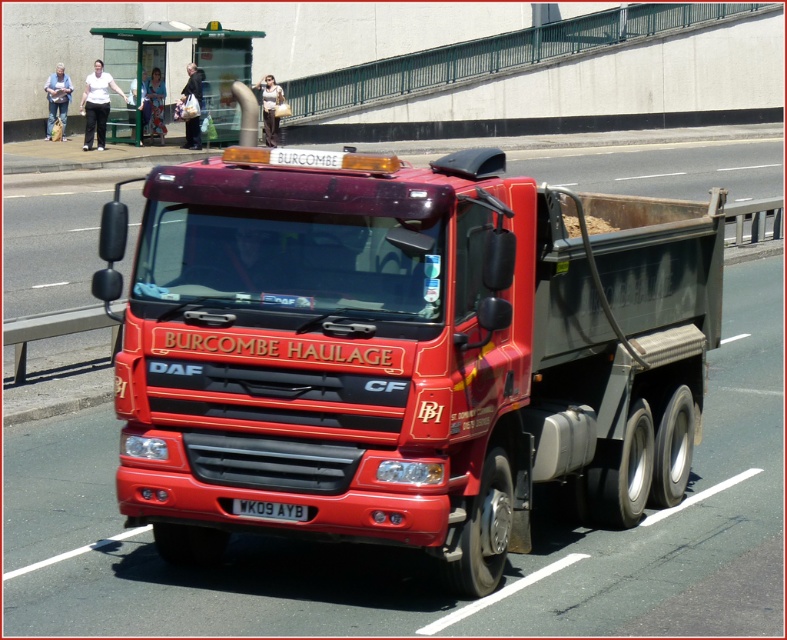
Question: Observing the image, what is the correct spatial positioning of matte red truck at center in reference to black plastic license plate at center?

Choices:
 (A) left
 (B) right

Answer: (B)

Question: Does matte red truck at center lie behind black plastic license plate at center?

Choices:
 (A) no
 (B) yes

Answer: (A)

Question: Among these objects, which one is nearest to the camera?

Choices:
 (A) matte red truck at center
 (B) black plastic license plate at center

Answer: (A)

Question: Among these points, which one is nearest to the camera?

Choices:
 (A) (279, 515)
 (B) (272, 444)

Answer: (A)

Question: Is matte red truck at center below black plastic license plate at center?

Choices:
 (A) yes
 (B) no

Answer: (B)